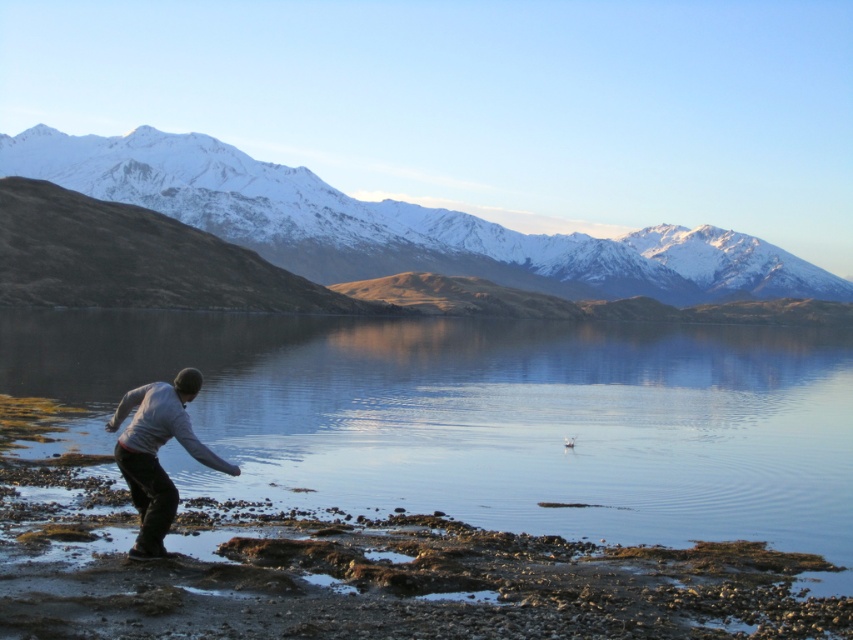
Question: Can you confirm if smooth water at center is positioned below snowy rocky mountain at upper center?

Choices:
 (A) no
 (B) yes

Answer: (B)

Question: Is smooth water at center to the left of gray cotton sweater at lower left from the viewer's perspective?

Choices:
 (A) no
 (B) yes

Answer: (A)

Question: Which of these objects is positioned farthest from the smooth water at center?

Choices:
 (A) snowy rocky mountain at upper center
 (B) gray cotton sweater at lower left

Answer: (A)

Question: Which point is closer to the camera?

Choices:
 (A) (x=820, y=381)
 (B) (x=143, y=433)

Answer: (B)

Question: Which point appears farthest from the camera in this image?

Choices:
 (A) (196, 208)
 (B) (440, 470)

Answer: (A)

Question: Observing the image, what is the correct spatial positioning of smooth water at center in reference to snowy rocky mountain at upper center?

Choices:
 (A) right
 (B) left

Answer: (B)